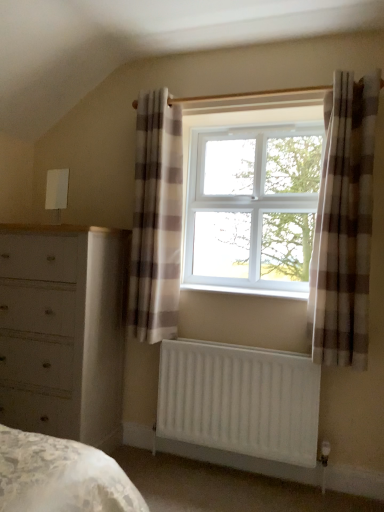
Question: Would you say brown checkered curtain at right, the first curtain viewed from the front, is part of plaid fabric curtain at center, the first curtain in the left-to-right sequence,'s contents?

Choices:
 (A) no
 (B) yes

Answer: (A)

Question: Is the position of plaid fabric curtain at center, which ranks as the 2th curtain in right-to-left order, less distant than that of brown checkered curtain at right, the first curtain viewed from the front?

Choices:
 (A) no
 (B) yes

Answer: (A)

Question: From the image's perspective, does plaid fabric curtain at center, which ranks as the 2th curtain in right-to-left order, appear higher than brown checkered curtain at right, the first curtain from the right?

Choices:
 (A) no
 (B) yes

Answer: (B)

Question: Can you confirm if plaid fabric curtain at center, which appears as the first curtain when viewed from the back, is shorter than brown checkered curtain at right, placed as the second curtain when sorted from left to right?

Choices:
 (A) yes
 (B) no

Answer: (B)

Question: Is plaid fabric curtain at center, the first curtain in the left-to-right sequence, at the left side of brown checkered curtain at right, which is counted as the second curtain, starting from the back?

Choices:
 (A) yes
 (B) no

Answer: (A)

Question: Can you confirm if plaid fabric curtain at center, which ranks as the 2th curtain in right-to-left order, is taller than brown checkered curtain at right, the first curtain viewed from the front?

Choices:
 (A) yes
 (B) no

Answer: (A)

Question: From the image's perspective, is white plastic window sill at center on white painted wood chest of drawers at left?

Choices:
 (A) no
 (B) yes

Answer: (B)

Question: Considering the relative positions of white plastic window sill at center and white painted wood chest of drawers at left in the image provided, is white plastic window sill at center in front of white painted wood chest of drawers at left?

Choices:
 (A) no
 (B) yes

Answer: (A)

Question: Is white painted wood chest of drawers at left at the back of white plastic window sill at center?

Choices:
 (A) yes
 (B) no

Answer: (B)

Question: Is white plastic window sill at center positioned beyond the bounds of white painted wood chest of drawers at left?

Choices:
 (A) yes
 (B) no

Answer: (A)

Question: Is white painted wood chest of drawers at left surrounded by white plastic window sill at center?

Choices:
 (A) no
 (B) yes

Answer: (A)

Question: Can you confirm if white plastic window sill at center is thinner than white painted wood chest of drawers at left?

Choices:
 (A) yes
 (B) no

Answer: (A)

Question: Is plaid fabric curtain at center, the first curtain in the left-to-right sequence, further to camera compared to white matte radiator at lower center?

Choices:
 (A) no
 (B) yes

Answer: (B)